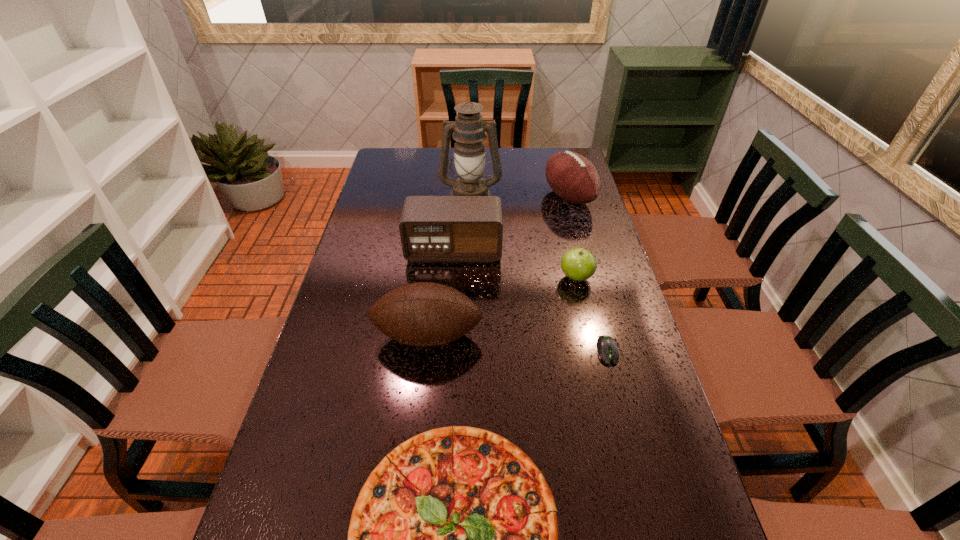
I want to click on free location located on the front-facing side of the third farthest object, so click(x=451, y=288).

This screenshot has width=960, height=540. I want to click on vacant point located 0.190m on the left of the fifth tallest object, so click(x=492, y=278).

You are a GUI agent. You are given a task and a screenshot of the screen. Output one action in this format:
    pyautogui.click(x=<x>, y=<y>)
    Task: Click on the blank area located on the wheel side of the sixth tallest object
    This screenshot has width=960, height=540.
    Given the screenshot: What is the action you would take?
    pyautogui.click(x=618, y=392)

You are a GUI agent. You are given a task and a screenshot of the screen. Output one action in this format:
    pyautogui.click(x=<x>, y=<y>)
    Task: Click on the object that is at the far edge
    The image size is (960, 540).
    Given the screenshot: What is the action you would take?
    pyautogui.click(x=572, y=177)

Where is `object that is at the left edge`? This screenshot has height=540, width=960. object that is at the left edge is located at coordinates (424, 314).

At what (x,y) coordinates should I click in order to perform the action: click on football (American) located at the right edge. Please return your answer as a coordinate pair (x, y). Looking at the image, I should click on (572, 177).

At what (x,y) coordinates should I click in order to perform the action: click on apple at the right edge. Please return your answer as a coordinate pair (x, y). The height and width of the screenshot is (540, 960). Looking at the image, I should click on (578, 264).

Locate an element on the screen. computer mouse that is positioned at the right edge is located at coordinates (606, 346).

Find the location of a particular element. The width and height of the screenshot is (960, 540). object at the far right corner is located at coordinates (572, 177).

Locate an element on the screen. This screenshot has width=960, height=540. free space at the far edge of the desktop is located at coordinates (518, 162).